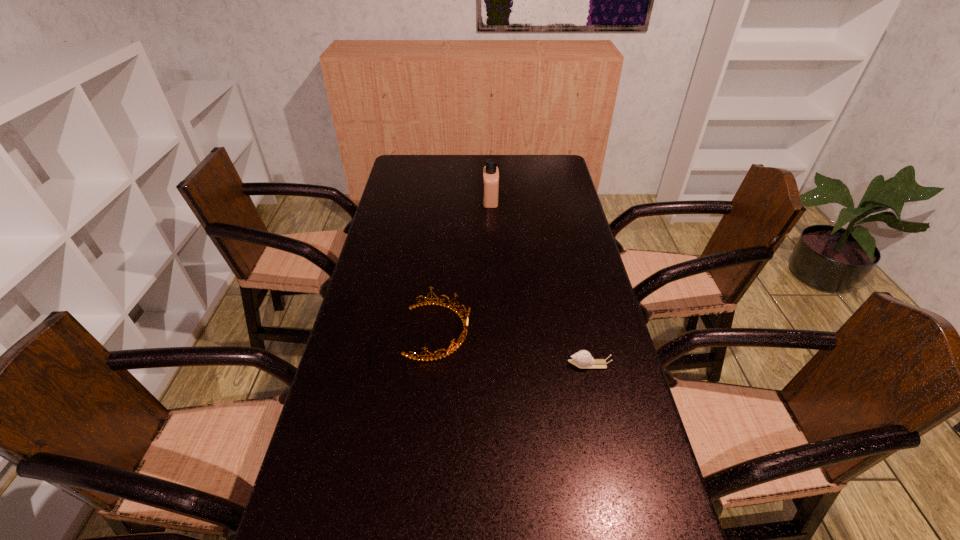
Image resolution: width=960 pixels, height=540 pixels. I want to click on the second object from right to left, so coord(490,172).

This screenshot has height=540, width=960. I want to click on the farthest object, so click(x=490, y=172).

At what (x,y) coordinates should I click in order to perform the action: click on tiara. Please return your answer as a coordinate pair (x, y). Looking at the image, I should click on (459, 312).

Locate an element on the screen. This screenshot has height=540, width=960. the leftmost object is located at coordinates (459, 312).

The image size is (960, 540). I want to click on escargot, so click(x=582, y=359).

What are the coordinates of `the shortest object` in the screenshot? It's located at (582, 359).

The width and height of the screenshot is (960, 540). What are the coordinates of `free spot located on the front label of the tallest object` in the screenshot? It's located at (440, 200).

Image resolution: width=960 pixels, height=540 pixels. I want to click on vacant region located on the front label of the tallest object, so click(x=427, y=200).

This screenshot has height=540, width=960. Identify the location of vacant region located on the front label of the tallest object. (412, 200).

The height and width of the screenshot is (540, 960). In order to click on vacant space located on the front-facing side of the second tallest object in this screenshot , I will do `click(564, 332)`.